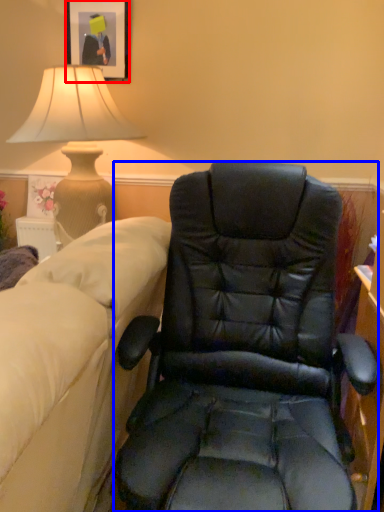
Question: Which object is further to the camera taking this photo, picture frame (highlighted by a red box) or chair (highlighted by a blue box)?

Choices:
 (A) picture frame
 (B) chair

Answer: (A)